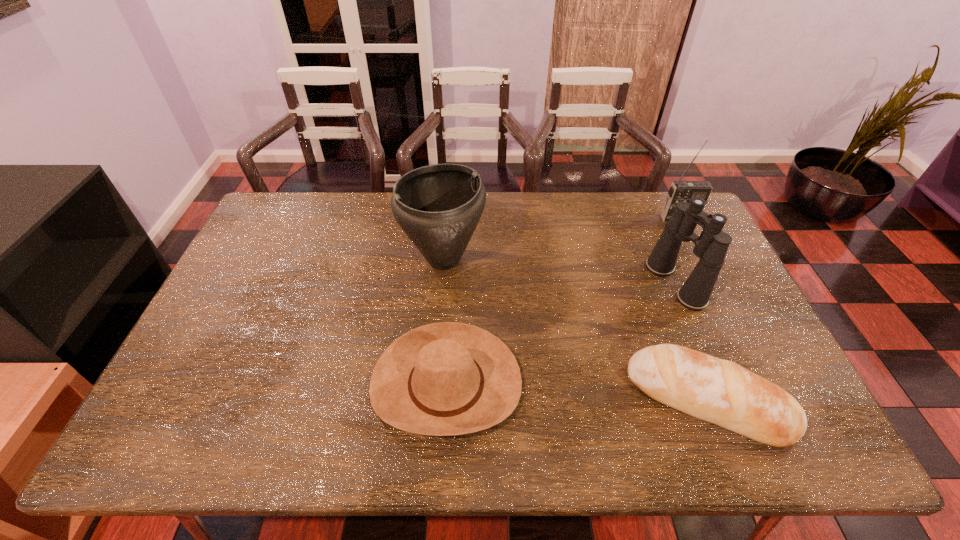
At what (x,y) coordinates should I click in order to perform the action: click on the farthest object. Please return your answer as a coordinate pair (x, y). This screenshot has height=540, width=960. Looking at the image, I should click on (680, 191).

Locate an element on the screen. urn is located at coordinates (438, 206).

What are the coordinates of `binoculars` in the screenshot? It's located at (711, 246).

The width and height of the screenshot is (960, 540). I want to click on cowboy hat, so click(442, 379).

At what (x,y) coordinates should I click in order to perform the action: click on bread. Please return your answer as a coordinate pair (x, y). The height and width of the screenshot is (540, 960). Looking at the image, I should click on (718, 391).

I want to click on vacant space situated 0.250m on the display of the farthest object, so click(707, 273).

The width and height of the screenshot is (960, 540). Identify the location of free location located on the left of the urn. (358, 259).

Identify the location of vacant space located on the left of the binoculars. The width and height of the screenshot is (960, 540). (569, 283).

Find the location of a particular element. The width and height of the screenshot is (960, 540). vacant space located on the back of the bread is located at coordinates (666, 295).

Where is `radio receiver located at the far edge`? The image size is (960, 540). radio receiver located at the far edge is located at coordinates (680, 191).